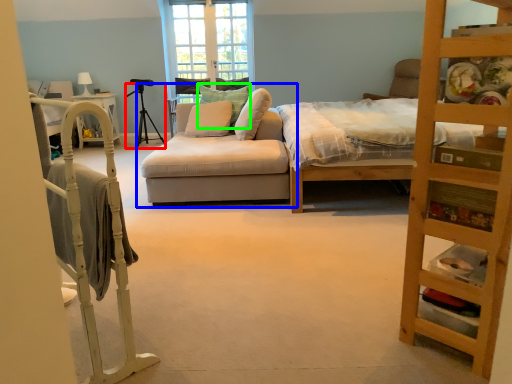
Question: Which object is positioned farthest from tripod (highlighted by a red box)? Select from studio couch (highlighted by a blue box) and pillow (highlighted by a green box).

Choices:
 (A) studio couch
 (B) pillow

Answer: (A)